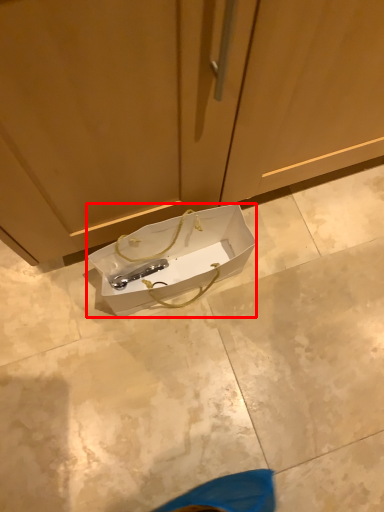
Question: From the image's perspective, where is box (annotated by the red box) located in relation to cabinetry in the image?

Choices:
 (A) above
 (B) below

Answer: (B)